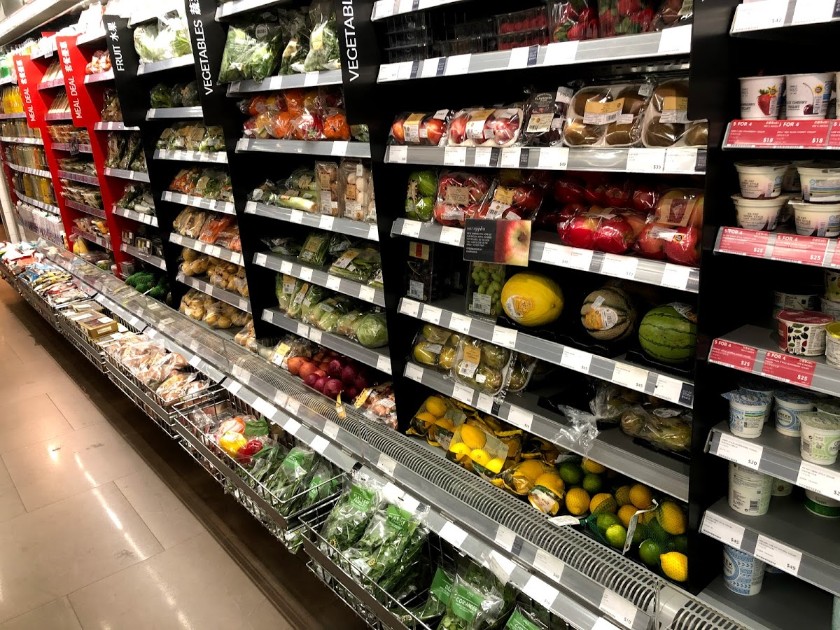
The image size is (840, 630). In order to click on black inner shelf in this screenshot , I will do `click(558, 329)`.